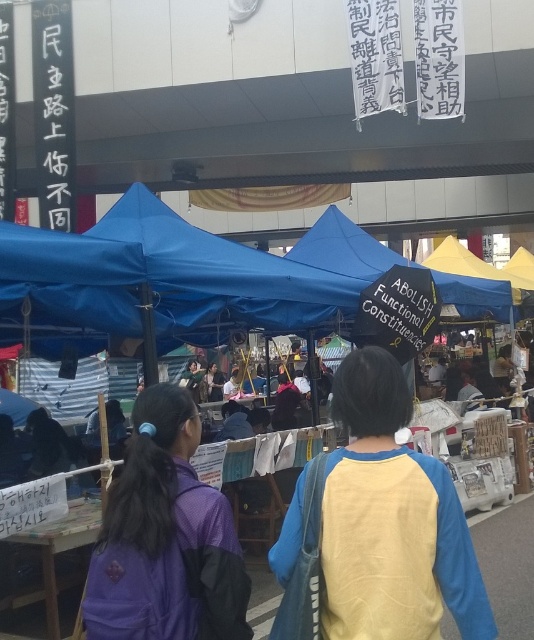
You are a photographer at the outdoor market scene. You notice a yellow fabric shirt at center and a purple fabric jacket at center. Which clothing item is located to the right when viewed from the front?

The yellow fabric shirt at center is positioned on the right side of the purple fabric jacket at center, so the yellow fabric shirt at center is located to the right.

You are a photographer standing in the market and want to take a photo of both the yellow fabric shirt at center and the purple fabric jacket at center. Which one should you focus on first to ensure both are in clear view?

You should focus on the yellow fabric shirt at center first since it is closer to the viewer than the purple fabric jacket at center, allowing both to be in focus when using depth of field appropriately.